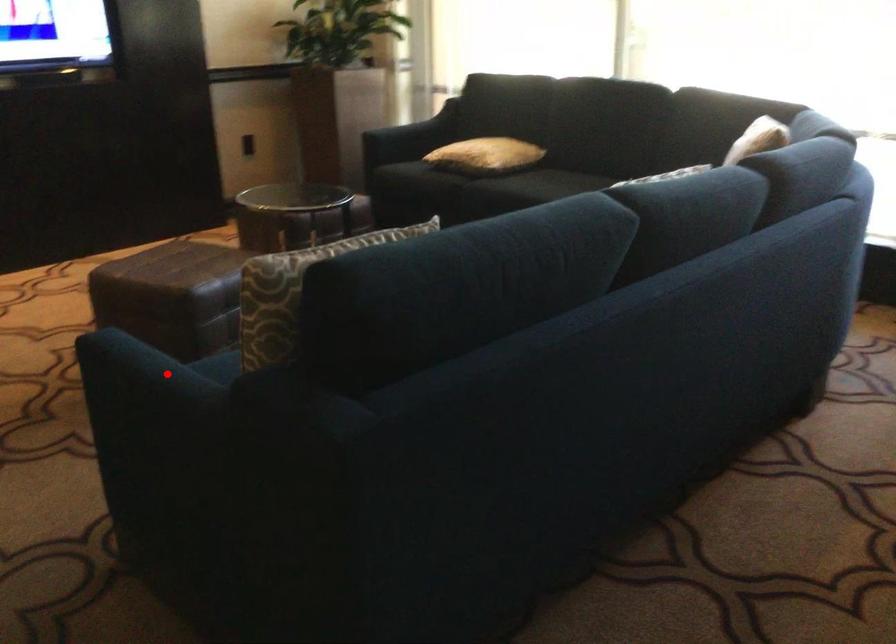
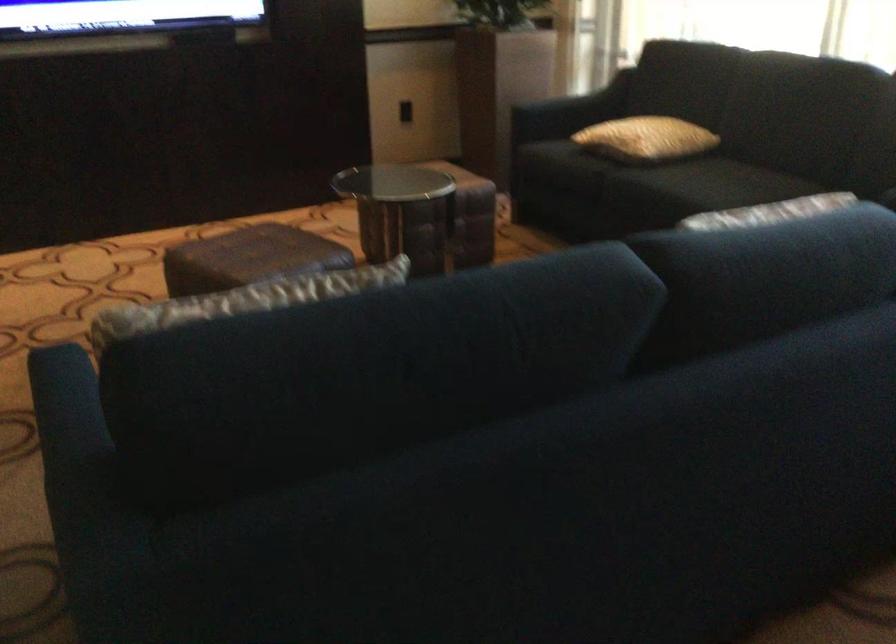
Question: A red point is marked in image1. In image2, is the corresponding 3D point closer to the camera or farther? Reply with the corresponding letter.

Choices:
 (A) The corresponding 3D point is closer.
 (B) The corresponding 3D point is farther.

Answer: (A)